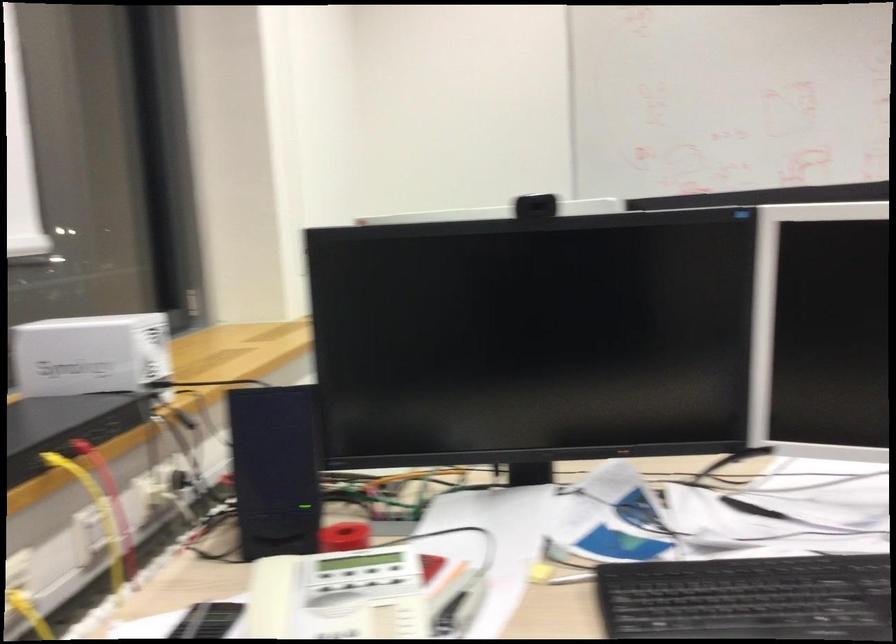
Find where to lift the black electronic device. Please return your answer as a coordinate pair (x, y).

(532, 337)